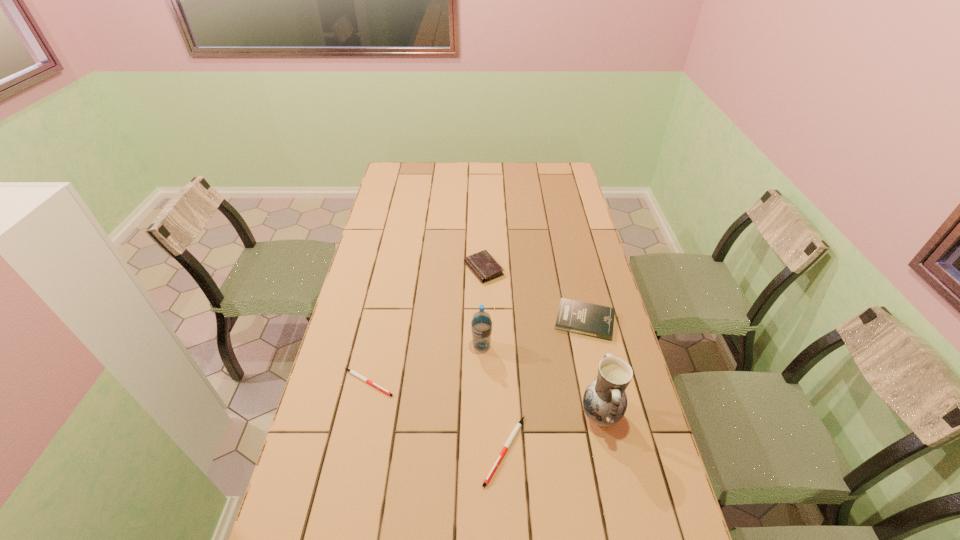
Where is `vacant space located on the left of the diary`? The width and height of the screenshot is (960, 540). vacant space located on the left of the diary is located at coordinates point(450,269).

Locate an element on the screen. The height and width of the screenshot is (540, 960). vacant space located 0.120m on the right of the second tallest object is located at coordinates (529, 346).

At what (x,y) coordinates should I click in order to perform the action: click on vacant region located 0.280m on the back of the book. Please return your answer as a coordinate pair (x, y). The width and height of the screenshot is (960, 540). Looking at the image, I should click on (568, 252).

Find the location of a particular element. This screenshot has width=960, height=540. vacant space located 0.180m on either side of the pottery is located at coordinates (516, 415).

Where is `vacant area situated 0.250m on either side of the pottery`? This screenshot has height=540, width=960. vacant area situated 0.250m on either side of the pottery is located at coordinates (491, 415).

At what (x,y) coordinates should I click in order to perform the action: click on vacant area situated 0.400m on either side of the pottery. Please return your answer as a coordinate pair (x, y). This screenshot has height=540, width=960. Looking at the image, I should click on [437, 415].

At what (x,y) coordinates should I click in order to perform the action: click on object at the left edge. Please return your answer as a coordinate pair (x, y). This screenshot has width=960, height=540. Looking at the image, I should click on tap(352, 372).

Identify the location of book situated at the right edge. The height and width of the screenshot is (540, 960). (587, 319).

The width and height of the screenshot is (960, 540). Find the location of `pottery located at the right edge`. pottery located at the right edge is located at coordinates (605, 402).

Identify the location of free space at the far edge of the desktop. Image resolution: width=960 pixels, height=540 pixels. (493, 179).